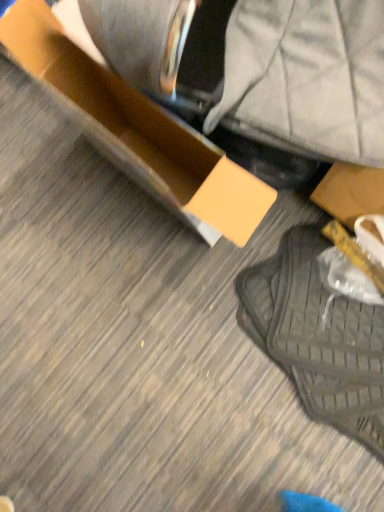
Where is `blank space above black mesh bag at lower right (from a real-world perspective)`? Image resolution: width=384 pixels, height=512 pixels. blank space above black mesh bag at lower right (from a real-world perspective) is located at coordinates (322, 329).